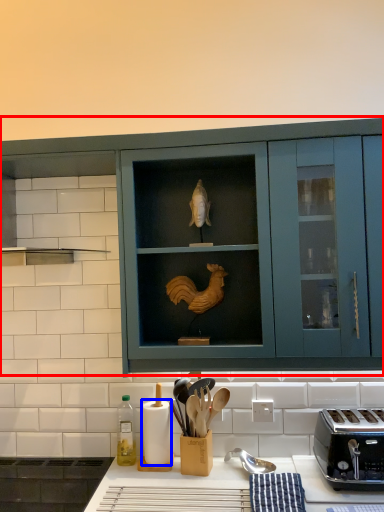
Question: Which of the following is the farthest to the observer, cabinetry (highlighted by a red box) or paper towel (highlighted by a blue box)?

Choices:
 (A) cabinetry
 (B) paper towel

Answer: (B)